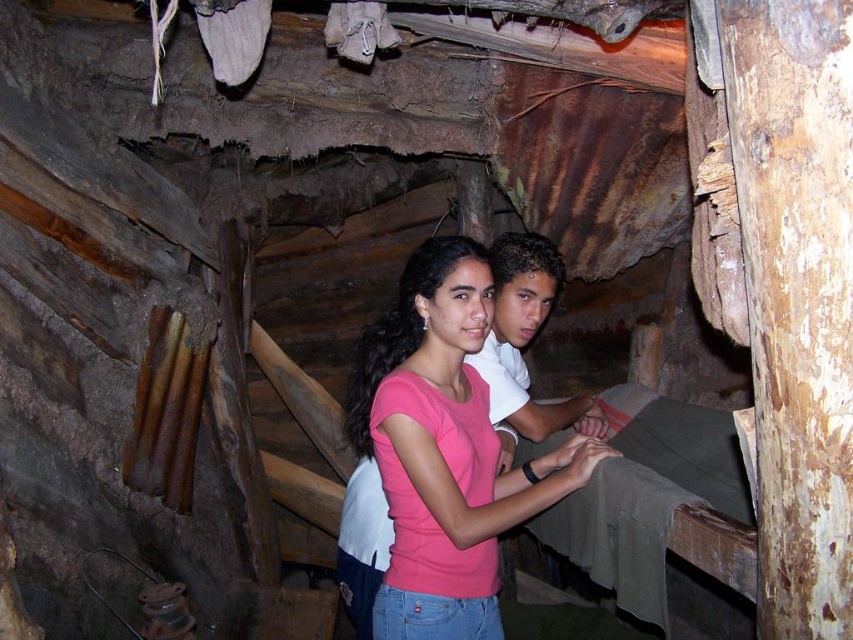
Question: Observing the image, what is the correct spatial positioning of pink matte shirt at center in reference to white matte shirt at center?

Choices:
 (A) right
 (B) left

Answer: (B)

Question: Where is pink matte shirt at center located in relation to white matte shirt at center in the image?

Choices:
 (A) right
 (B) left

Answer: (B)

Question: Does pink matte shirt at center lie behind white matte shirt at center?

Choices:
 (A) yes
 (B) no

Answer: (B)

Question: Among these points, which one is farthest from the camera?

Choices:
 (A) (448, 502)
 (B) (552, 426)

Answer: (B)